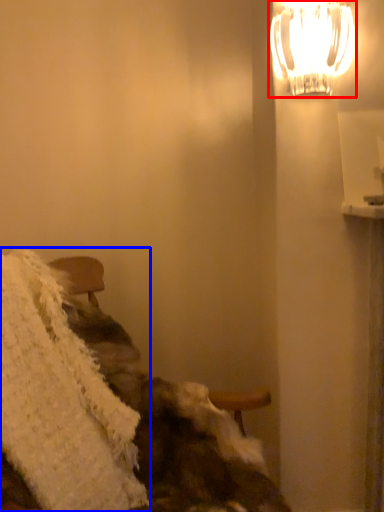
Question: Which object is further to the camera taking this photo, lamp (highlighted by a red box) or blanket (highlighted by a blue box)?

Choices:
 (A) lamp
 (B) blanket

Answer: (A)